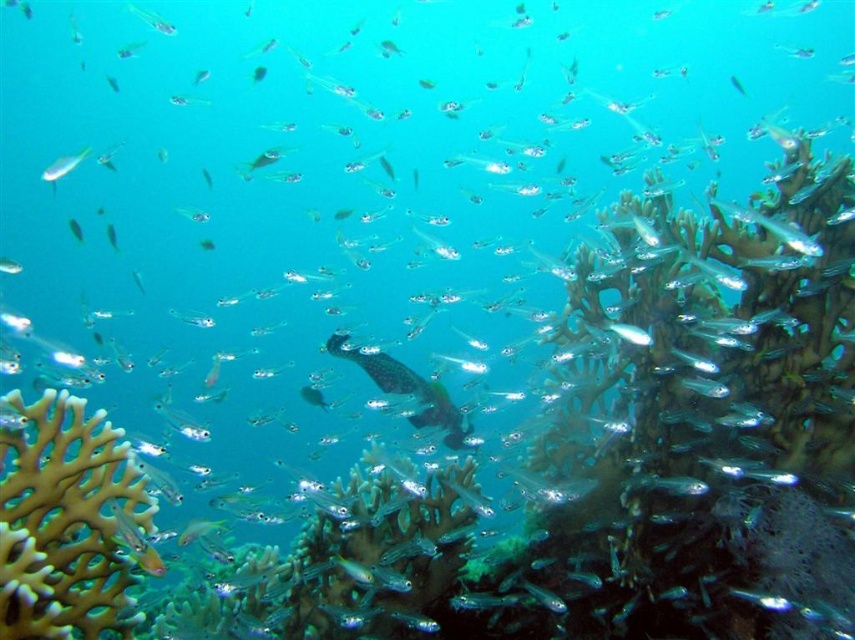
Question: Is the position of brown porous coral at lower left more distant than that of translucent glass at upper left?

Choices:
 (A) no
 (B) yes

Answer: (A)

Question: Among these objects, which one is nearest to the camera?

Choices:
 (A) translucent glass at upper left
 (B) brown porous coral at lower left

Answer: (B)

Question: Is brown porous coral at lower left thinner than translucent glass at upper left?

Choices:
 (A) no
 (B) yes

Answer: (A)

Question: Which point is farther to the camera?

Choices:
 (A) translucent glass at upper left
 (B) brown porous coral at lower left

Answer: (A)

Question: Does brown porous coral at lower left have a smaller size compared to translucent glass at upper left?

Choices:
 (A) no
 (B) yes

Answer: (A)